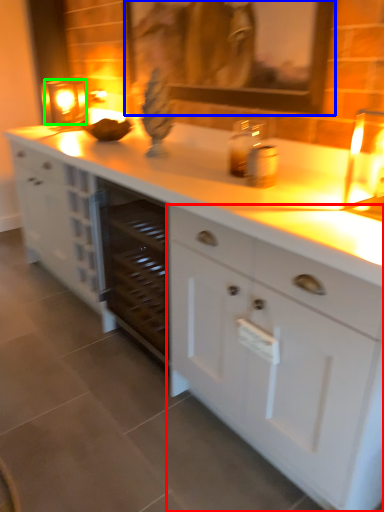
Question: Estimate the real-world distances between objects in this image. Which object is farther from cabinetry (highlighted by a red box), picture frame (highlighted by a blue box) or candle holder (highlighted by a green box)?

Choices:
 (A) picture frame
 (B) candle holder

Answer: (B)